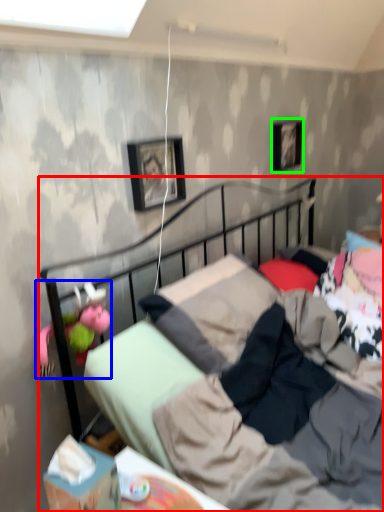
Question: Considering the real-world distances, which object is farthest from bed (highlighted by a red box)? doll (highlighted by a blue box) or picture frame (highlighted by a green box)?

Choices:
 (A) doll
 (B) picture frame

Answer: (B)